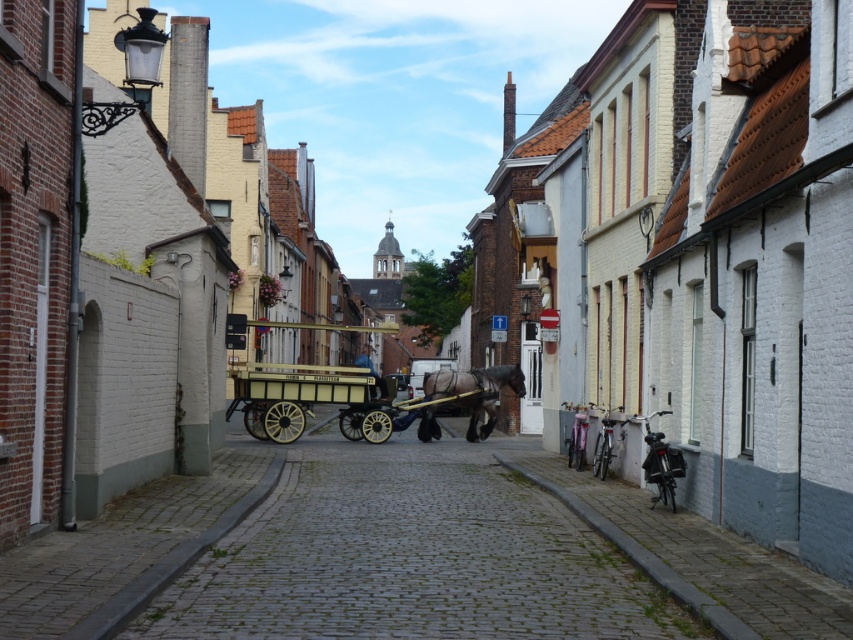
Which is above, wooden polished cart at center or dark brown glossy horse at center?

dark brown glossy horse at center

Who is positioned more to the left, wooden polished cart at center or dark brown glossy horse at center?

Positioned to the left is wooden polished cart at center.

This screenshot has height=640, width=853. I want to click on wooden polished cart at center, so click(305, 397).

Which is in front, point (459, 392) or point (369, 365)?

Positioned in front is point (459, 392).

Describe the element at coordinates (467, 396) in the screenshot. I see `dark brown glossy horse at center` at that location.

Locate an element on the screen. dark brown glossy horse at center is located at coordinates (467, 396).

Where is `dark brown glossy horse at center`? dark brown glossy horse at center is located at coordinates (467, 396).

The height and width of the screenshot is (640, 853). What do you see at coordinates (305, 397) in the screenshot?
I see `wooden polished cart at center` at bounding box center [305, 397].

Who is more distant from viewer, (358, 388) or (355, 365)?

Point (355, 365)

You are a GUI agent. You are given a task and a screenshot of the screen. Output one action in this format:
    pyautogui.click(x=<x>, y=<y>)
    Task: Click on the wooden polished cart at center
    This screenshot has width=853, height=640.
    Given the screenshot: What is the action you would take?
    pyautogui.click(x=305, y=397)